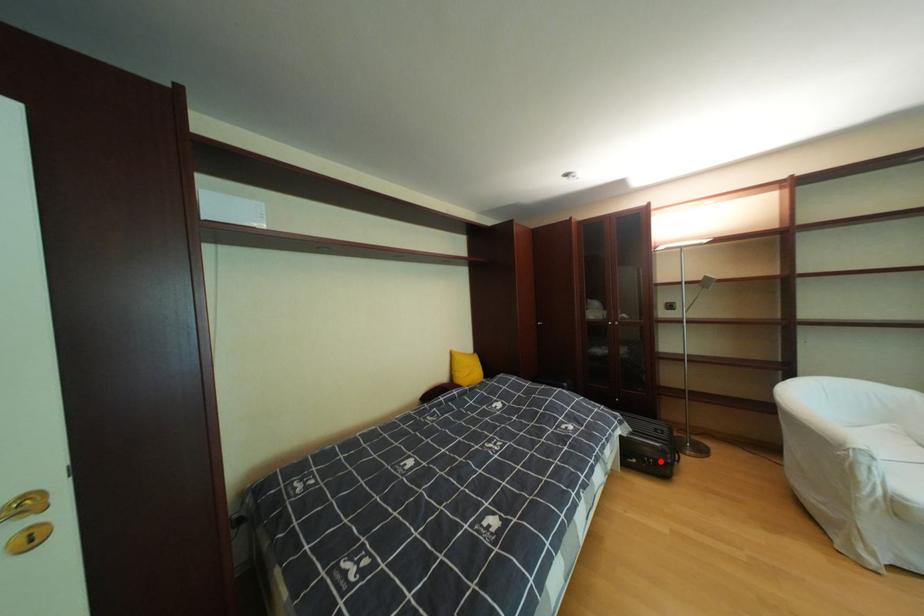
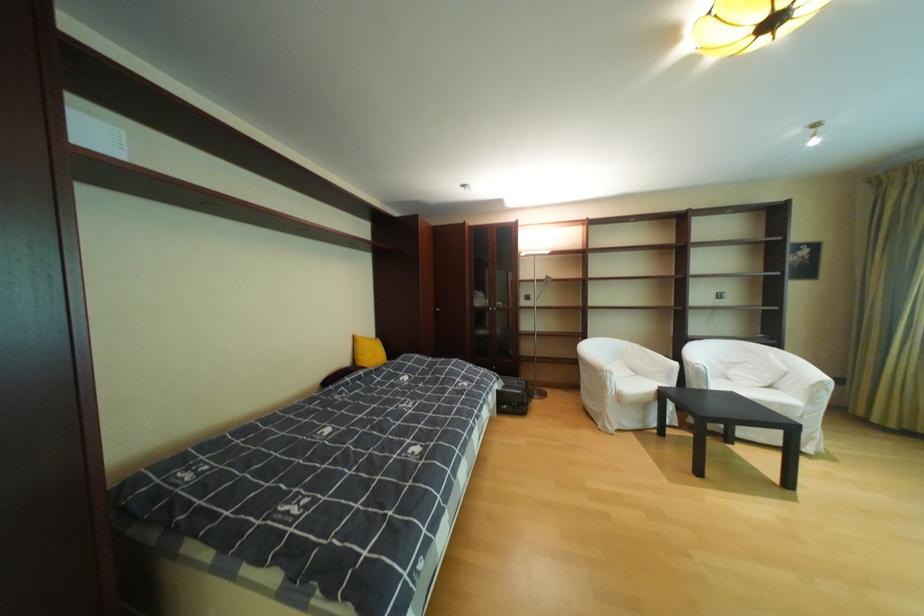
The point at the highlighted location is marked in the first image. Where is the corresponding point in the second image?

(526, 405)